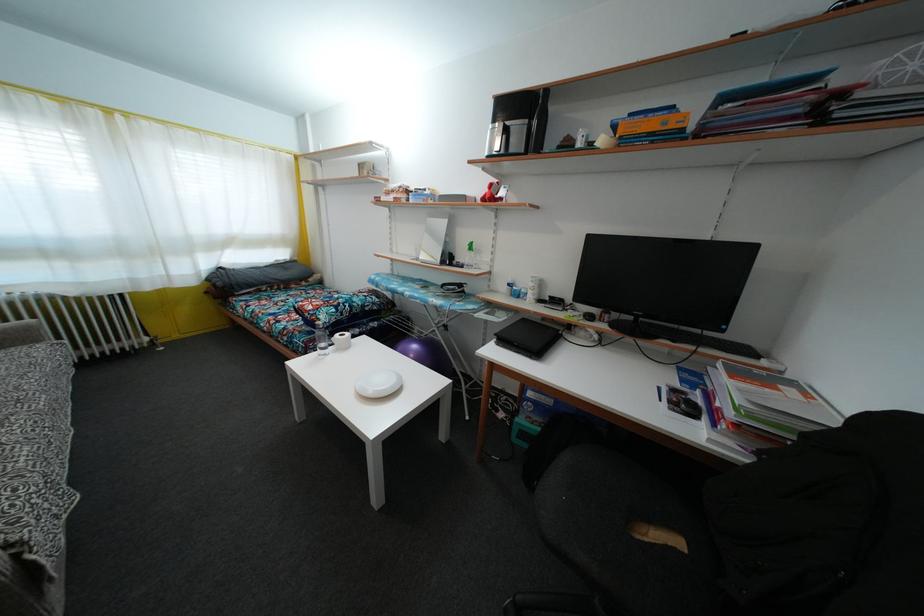
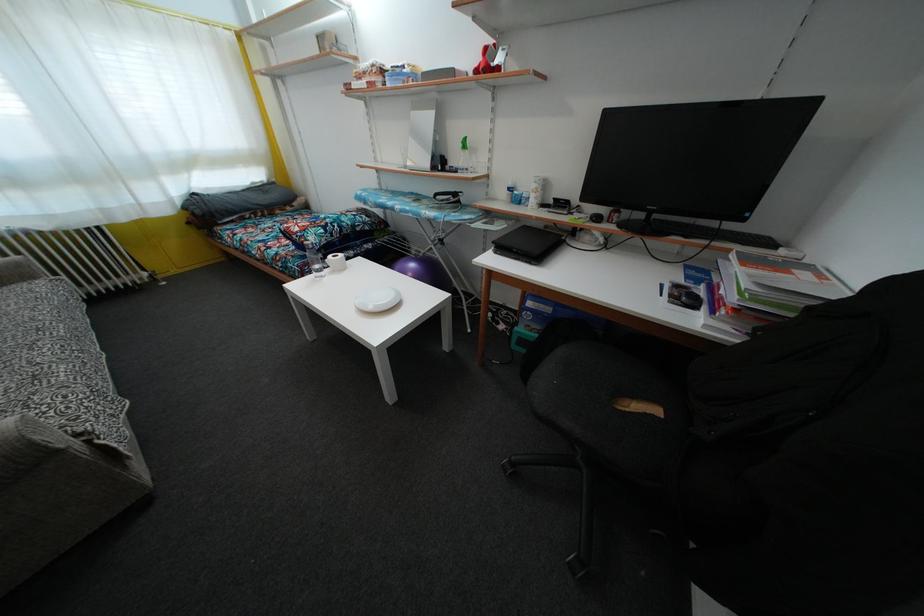
In the second image, find the point that corresponds to point 507,347 in the first image.

(506, 254)